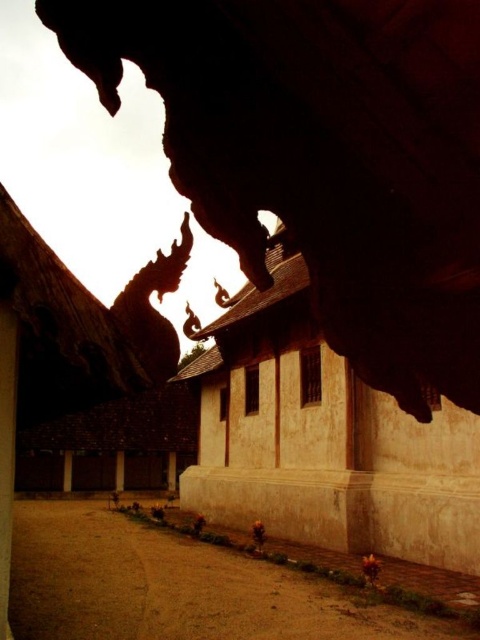
Question: Which point appears closest to the camera in this image?

Choices:
 (A) (67, 458)
 (B) (116, 461)
 (C) (173, 465)

Answer: (A)

Question: Is brown stone pillar at lower center to the left of smooth stone pillar at center from the viewer's perspective?

Choices:
 (A) no
 (B) yes

Answer: (B)

Question: Is brown stone pillar at lower center wider than smooth stone pillar at center?

Choices:
 (A) yes
 (B) no

Answer: (B)

Question: Which is nearer to the smooth stone pillar at center?

Choices:
 (A) brown stone pillar at lower center
 (B) beige textured wall at center

Answer: (A)

Question: Is brown wood pillar at lower left below smooth stone pillar at center?

Choices:
 (A) yes
 (B) no

Answer: (B)

Question: Which point is closer to the camera?

Choices:
 (A) brown wood pillar at lower left
 (B) brown stone pillar at lower center

Answer: (A)